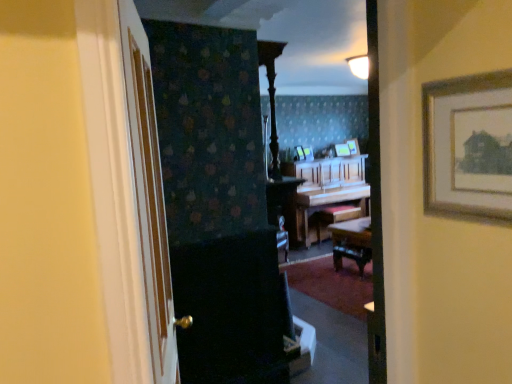
Question: Can you confirm if wooden piano at center is positioned to the left of wooden picture frame at center, which is the 2th picture frame from right to left?

Choices:
 (A) no
 (B) yes

Answer: (B)

Question: Does wooden piano at center have a smaller size compared to wooden picture frame at center, marked as the third picture frame in a left-to-right arrangement?

Choices:
 (A) yes
 (B) no

Answer: (B)

Question: Is wooden piano at center taller than wooden picture frame at center, which is the 2th picture frame from right to left?

Choices:
 (A) no
 (B) yes

Answer: (B)

Question: Considering the relative sizes of wooden piano at center and wooden picture frame at center, marked as the third picture frame in a left-to-right arrangement, in the image provided, is wooden piano at center thinner than wooden picture frame at center, marked as the third picture frame in a left-to-right arrangement,?

Choices:
 (A) yes
 (B) no

Answer: (B)

Question: Is wooden piano at center oriented away from wooden picture frame at center, marked as the third picture frame in a left-to-right arrangement?

Choices:
 (A) no
 (B) yes

Answer: (A)

Question: Is wooden piano at center wider than wooden picture frame at center, marked as the third picture frame in a left-to-right arrangement?

Choices:
 (A) yes
 (B) no

Answer: (A)

Question: Can you confirm if wooden picture frame at center, which is the 2th picture frame from right to left, is thinner than metallic silver picture frame at center, which is the first picture frame from left to right?

Choices:
 (A) no
 (B) yes

Answer: (B)

Question: From the image's perspective, is wooden picture frame at center, which is the 2th picture frame from right to left, below metallic silver picture frame at center, which is the first picture frame from left to right?

Choices:
 (A) yes
 (B) no

Answer: (B)

Question: Is wooden picture frame at center, which is the 2th picture frame from right to left, looking in the opposite direction of metallic silver picture frame at center, which is the first picture frame from left to right?

Choices:
 (A) yes
 (B) no

Answer: (B)

Question: Can you confirm if wooden picture frame at center, which is the 2th picture frame from right to left, is smaller than metallic silver picture frame at center, the fourth picture frame from the right?

Choices:
 (A) yes
 (B) no

Answer: (B)

Question: Is wooden picture frame at center, marked as the third picture frame in a left-to-right arrangement, outside metallic silver picture frame at center, the fourth picture frame from the right?

Choices:
 (A) yes
 (B) no

Answer: (A)

Question: Is wooden picture frame at center, which is the 2th picture frame from right to left, placed right next to metallic silver picture frame at center, which is the first picture frame from left to right?

Choices:
 (A) yes
 (B) no

Answer: (B)

Question: Can you confirm if wooden picture frame at center, placed as the 1th picture frame when sorted from right to left, is wider than white wood door at left?

Choices:
 (A) yes
 (B) no

Answer: (B)